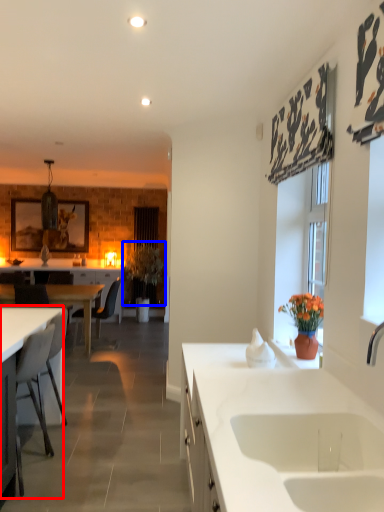
Question: Which of the following is the farthest to the observer, desk (highlighted by a red box) or plant (highlighted by a blue box)?

Choices:
 (A) desk
 (B) plant

Answer: (B)